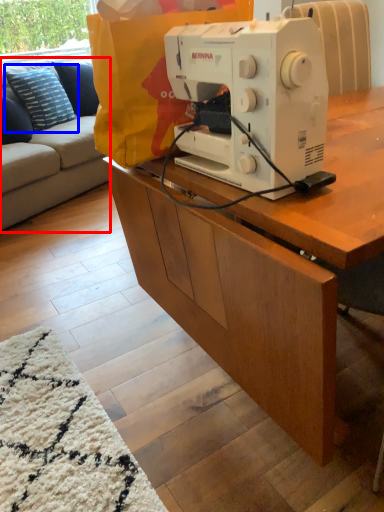
Question: Which object appears closest to the camera in this image, studio couch (highlighted by a red box) or pillow (highlighted by a blue box)?

Choices:
 (A) studio couch
 (B) pillow

Answer: (A)